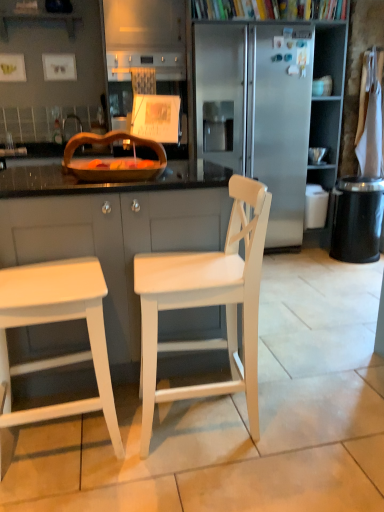
Find the location of a particular element. free point below white matte stool at left (from a real-world perspective) is located at coordinates (59, 441).